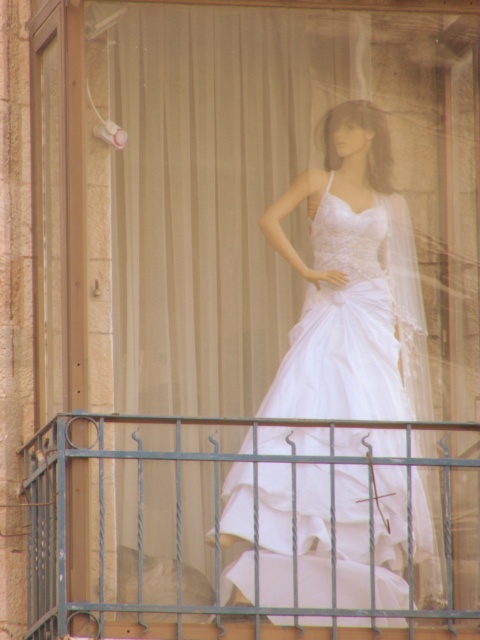
Question: Which point is farther to the camera?

Choices:
 (A) (261, 467)
 (B) (301, 490)

Answer: (A)

Question: Can you confirm if white satin dress at center is bigger than metallic wrought iron railing at lower center?

Choices:
 (A) yes
 (B) no

Answer: (A)

Question: Is white satin dress at center further to camera compared to metallic wrought iron railing at lower center?

Choices:
 (A) yes
 (B) no

Answer: (A)

Question: Where is white satin dress at center located in relation to metallic wrought iron railing at lower center in the image?

Choices:
 (A) below
 (B) above

Answer: (B)